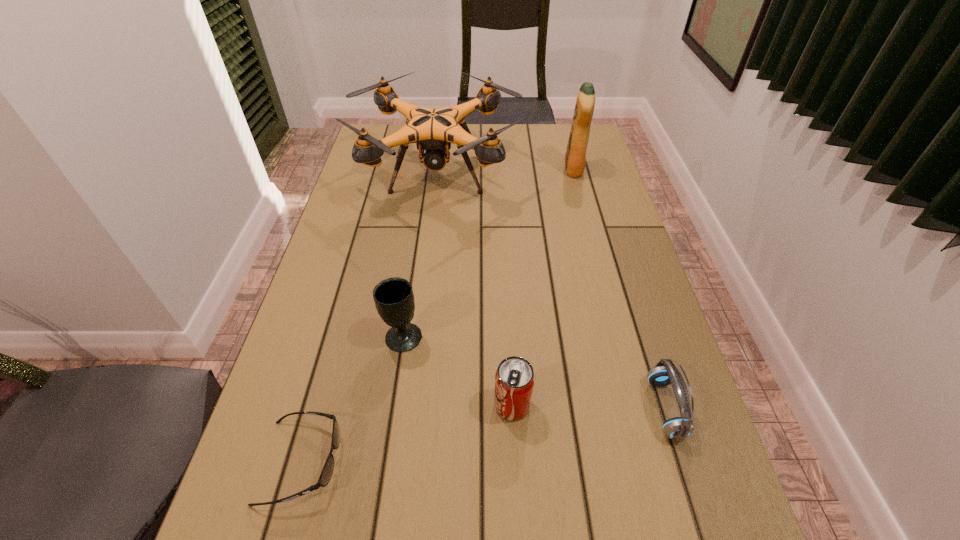
You are a GUI agent. You are given a task and a screenshot of the screen. Output one action in this format:
    pyautogui.click(x=<x>, y=<y>)
    Task: Click on the free spot between the headset and the drone
    This screenshot has width=960, height=540.
    Given the screenshot: What is the action you would take?
    pyautogui.click(x=551, y=292)

Where is `free space that is in between the second shortest object and the detergent`? free space that is in between the second shortest object and the detergent is located at coordinates (619, 289).

The height and width of the screenshot is (540, 960). Find the location of `empty space that is in between the drone and the sunglasses`. empty space that is in between the drone and the sunglasses is located at coordinates (370, 318).

Find the location of `vacant space that's between the drone and the sunglasses`. vacant space that's between the drone and the sunglasses is located at coordinates (370, 318).

You are a GUI agent. You are given a task and a screenshot of the screen. Output one action in this format:
    pyautogui.click(x=<x>, y=<y>)
    Task: Click on the empty space that is in between the shortest object and the pop soda
    
    Given the screenshot: What is the action you would take?
    pos(407,433)

Where is `vacant space that is in between the detergent and the sunglasses`? This screenshot has width=960, height=540. vacant space that is in between the detergent and the sunglasses is located at coordinates (438, 315).

The height and width of the screenshot is (540, 960). I want to click on object that is the fifth closest to the shortest object, so click(x=575, y=158).

What are the coordinates of `the third closest object to the pop soda` in the screenshot? It's located at (326, 474).

Where is `free spot that satisfies the following two spatial constraints: 1. on the front side of the fourth nearest object; 2. on the front-facing side of the shortest object`? This screenshot has width=960, height=540. free spot that satisfies the following two spatial constraints: 1. on the front side of the fourth nearest object; 2. on the front-facing side of the shortest object is located at coordinates (384, 462).